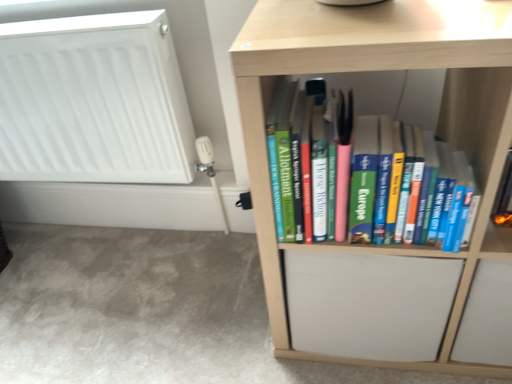
Question: Considering the positions of white matte radiator at upper left and light wood bookshelf at center in the image, is white matte radiator at upper left taller or shorter than light wood bookshelf at center?

Choices:
 (A) short
 (B) tall

Answer: (A)

Question: Is white matte radiator at upper left spatially inside light wood bookshelf at center, or outside of it?

Choices:
 (A) outside
 (B) inside

Answer: (A)

Question: Is white matte radiator at upper left to the left or to the right of light wood bookshelf at center in the image?

Choices:
 (A) left
 (B) right

Answer: (A)

Question: Relative to white matte radiator at upper left, is light wood bookshelf at center in front or behind?

Choices:
 (A) front
 (B) behind

Answer: (A)

Question: Looking at the image, does light wood bookshelf at center seem bigger or smaller compared to white matte radiator at upper left?

Choices:
 (A) small
 (B) big

Answer: (B)

Question: In terms of width, does light wood bookshelf at center look wider or thinner when compared to white matte radiator at upper left?

Choices:
 (A) thin
 (B) wide

Answer: (B)

Question: From a real-world perspective, is light wood bookshelf at center positioned above or below white matte radiator at upper left?

Choices:
 (A) above
 (B) below

Answer: (B)